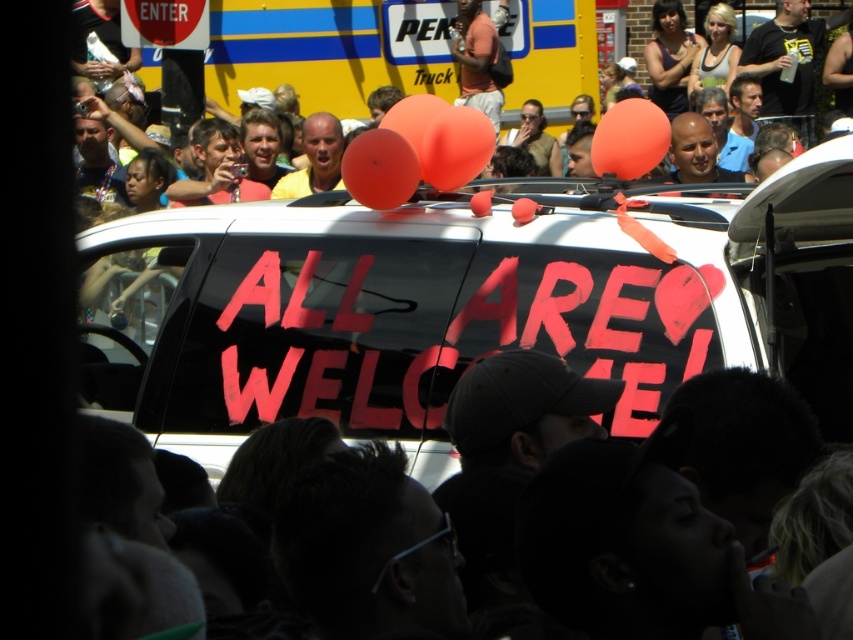
Can you confirm if matte black car at upper center is shorter than orange matte balloon at center?

In fact, matte black car at upper center may be taller than orange matte balloon at center.

Is point (421, 67) farther from viewer compared to point (624, 170)?

Yes, point (421, 67) is behind point (624, 170).

Is point (265, 40) farther from camera compared to point (595, 154)?

Yes, point (265, 40) is farther from viewer.

Locate an element on the screen. matte black car at upper center is located at coordinates (329, 48).

Does rubber balloon at center come behind rubber matte balloon at center?

No.

Is point (440, 179) closer to camera compared to point (410, 112)?

Yes.

The width and height of the screenshot is (853, 640). I want to click on rubber balloon at center, so click(x=456, y=147).

Is white matte police van at center wider than matte black car at upper center?

In fact, white matte police van at center might be narrower than matte black car at upper center.

Where is `white matte police van at center`? white matte police van at center is located at coordinates (397, 310).